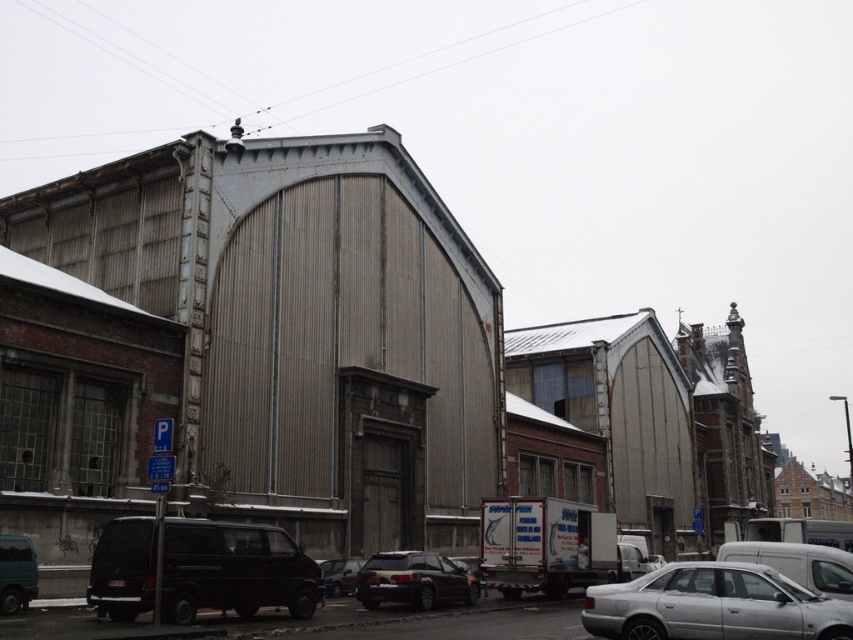
Can you confirm if teal matte van at lower left is shorter than silver metallic sedan at center?

Indeed, teal matte van at lower left has a lesser height compared to silver metallic sedan at center.

Is teal matte van at lower left positioned in front of silver metallic sedan at center?

That is True.

Is point (21, 593) positioned after point (654, 564)?

No, (21, 593) is closer to viewer.

Image resolution: width=853 pixels, height=640 pixels. What are the coordinates of `teal matte van at lower left` in the screenshot? It's located at (16, 573).

Is point (845, 595) in front of point (659, 560)?

Yes, it is in front of point (659, 560).

Which of these two, white matte van at lower right or silver metallic sedan at center, stands shorter?

Standing shorter between the two is silver metallic sedan at center.

The width and height of the screenshot is (853, 640). What do you see at coordinates (798, 563) in the screenshot? I see `white matte van at lower right` at bounding box center [798, 563].

Image resolution: width=853 pixels, height=640 pixels. In order to click on white matte van at lower right in this screenshot , I will do `click(798, 563)`.

Based on the photo, is silver metallic car at lower right thinner than shiny black sedan at center?

Incorrect, silver metallic car at lower right's width is not less than shiny black sedan at center's.

Is silver metallic car at lower right taller than shiny black sedan at center?

Yes.

Identify the location of silver metallic car at lower right. The height and width of the screenshot is (640, 853). (712, 605).

This screenshot has width=853, height=640. I want to click on silver metallic car at lower right, so click(712, 605).